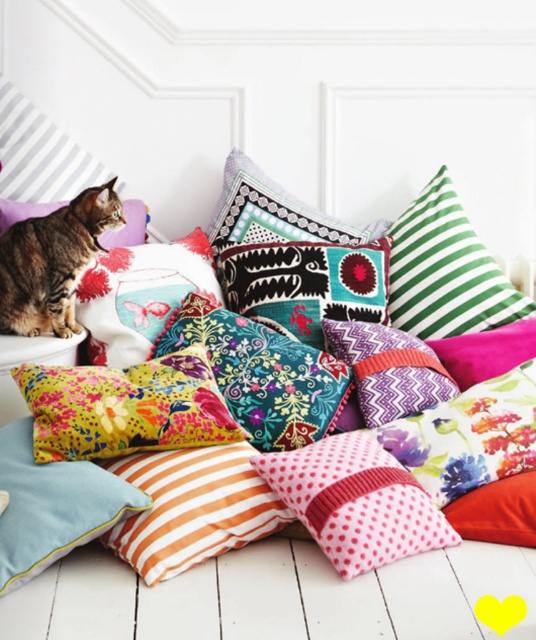
Between orange striped pillow at center and textured multicolored cushion at center, which one appears on the left side from the viewer's perspective?

orange striped pillow at center is more to the left.

This screenshot has width=536, height=640. Describe the element at coordinates (192, 508) in the screenshot. I see `orange striped pillow at center` at that location.

Between point (114, 470) and point (235, 214), which one is positioned behind?

Point (235, 214)

Find the location of a particular element. This screenshot has width=536, height=640. orange striped pillow at center is located at coordinates (192, 508).

Which is more to the left, orange striped pillow at center or tabby fur cat at upper left?

From the viewer's perspective, tabby fur cat at upper left appears more on the left side.

Can you confirm if orange striped pillow at center is shorter than tabby fur cat at upper left?

Correct, orange striped pillow at center is not as tall as tabby fur cat at upper left.

I want to click on orange striped pillow at center, so click(x=192, y=508).

Does pink dotted fabric pillow at center have a lesser width compared to tabby fur cat at upper left?

No.

Identify the location of pink dotted fabric pillow at center. Image resolution: width=536 pixels, height=640 pixels. (355, 500).

Locate an element on the screen. The image size is (536, 640). pink dotted fabric pillow at center is located at coordinates (355, 500).